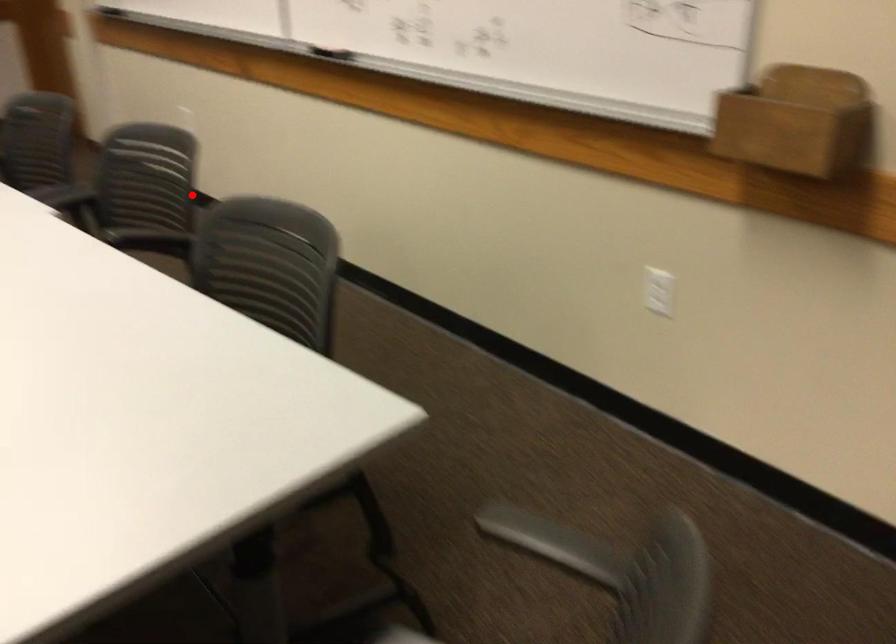
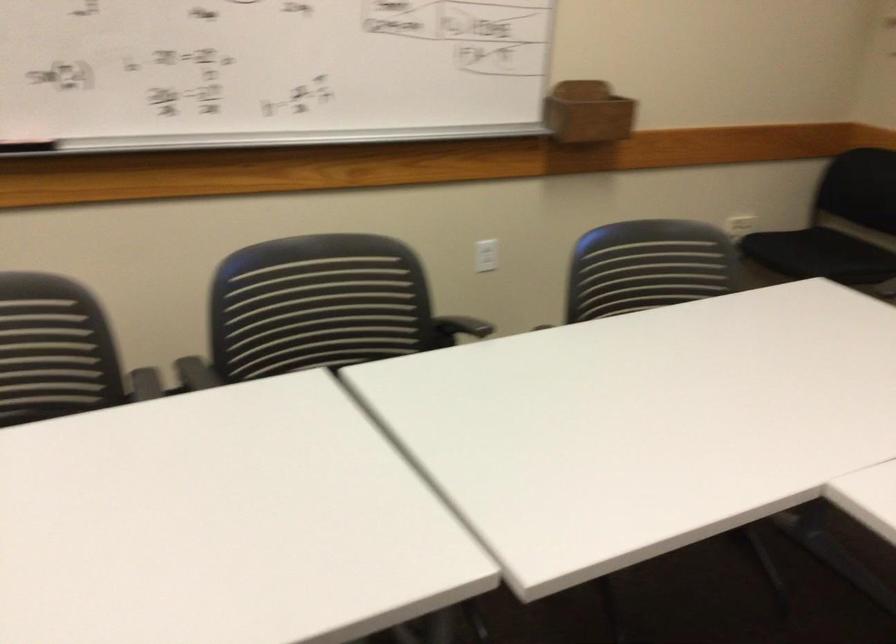
Where in the second image is the point corresponding to the highlighted location from the first image?

(317, 308)